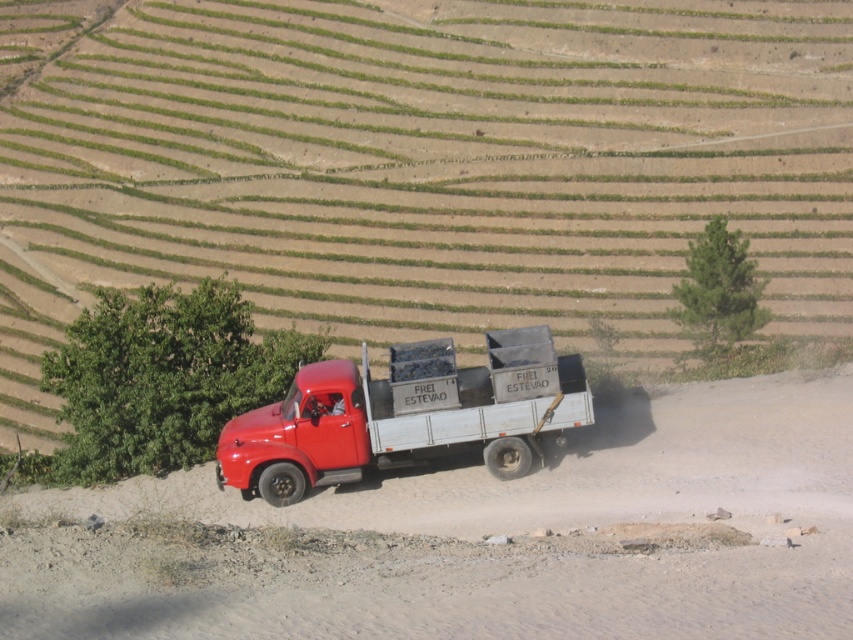
You are a passenger in the shiny red truck at center. You look out the window and see the dusty gravel road at lower center. Which side of the truck is the road located?

The dusty gravel road at lower center is to the right of the shiny red truck at center, so the road is on the right side of the truck.

You are a drone operator trying to capture aerial footage of the rural scene. The drone is currently hovering at position coordinates of 0.7, 0.6. You want to adjust the camera to focus on the dusty gravel road at lower center. Is the road to the north or south of your current position?

The dusty gravel road at lower center is located at coordinates (x=479, y=538). Since your current position is at (x=511, y=448), the road is to the south of your current position because the y coordinate of the road is lower than yours.

You are a delivery driver who needs to park your shiny red truck at center on the dusty gravel road at lower center. Can you safely park the truck on the road without overhanging the road edges? The truck is 8 meters long.

The distance between the shiny red truck at center and the dusty gravel road at lower center is 8.01 meters. Since the truck is 8 meters long, there is just enough space to park it safely without overhanging the road edges.